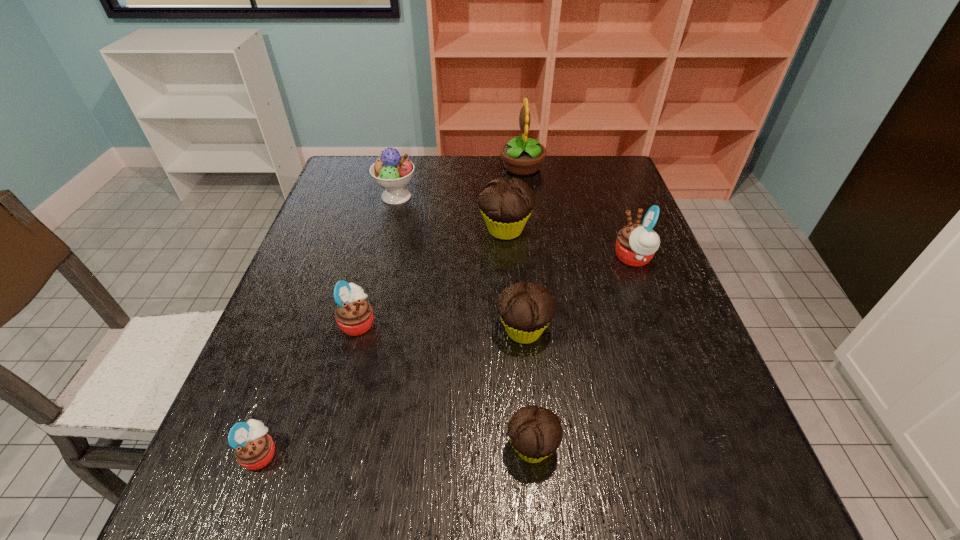
Identify the location of blank space at the near edge. The image size is (960, 540). (628, 503).

This screenshot has width=960, height=540. In the image, there is a desktop. What are the coordinates of `blank space at the left edge` in the screenshot? It's located at (305, 308).

Image resolution: width=960 pixels, height=540 pixels. Find the location of `free space at the right edge`. free space at the right edge is located at coordinates (756, 469).

The width and height of the screenshot is (960, 540). In order to click on vacant region at the far left corner in this screenshot , I will do `click(364, 167)`.

In order to click on free region at the far right corner of the desktop in this screenshot , I will do `click(595, 178)`.

Locate an element on the screen. free space at the near right corner is located at coordinates (722, 532).

Locate an element on the screen. The image size is (960, 540). vacant region between the farthest object and the second smallest chocolate muffin is located at coordinates (523, 249).

The height and width of the screenshot is (540, 960). In order to click on vacant region between the nearest pink muffin and the nearest chocolate muffin in this screenshot , I will do `click(396, 450)`.

Where is `unoccupied area between the biggest chocolate muffin and the leftmost pink muffin`? The width and height of the screenshot is (960, 540). unoccupied area between the biggest chocolate muffin and the leftmost pink muffin is located at coordinates (383, 342).

This screenshot has width=960, height=540. What are the coordinates of `vacant region between the rightmost object and the farthest chocolate muffin` in the screenshot? It's located at (569, 244).